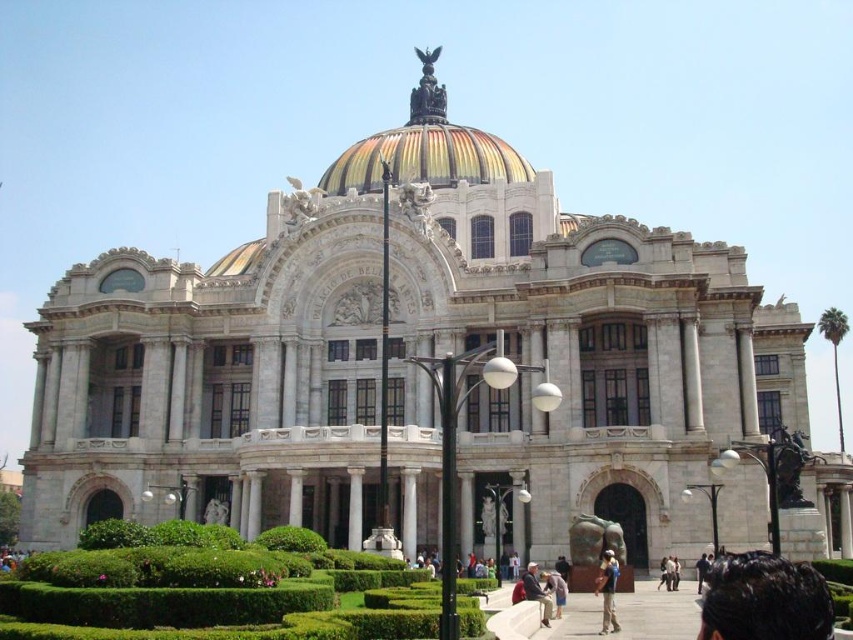
Question: Can you confirm if polished bronze eagle at center is bigger than dark blue jeans at center?

Choices:
 (A) yes
 (B) no

Answer: (A)

Question: Is dark brown hair at lower right below dark blue jeans at center?

Choices:
 (A) no
 (B) yes

Answer: (A)

Question: Among these points, which one is farthest from the camera?

Choices:
 (A) (614, 566)
 (B) (296, 205)
 (C) (409, 116)
 (D) (317, 532)

Answer: (C)

Question: Which point is farther to the camera?

Choices:
 (A) dark blue jeans at center
 (B) light brown leather jacket at center
 (C) dark brown hair at lower right
 (D) polished bronze eagle at center

Answer: (D)

Question: Is white marble statue at upper center below light brown leather jacket at center?

Choices:
 (A) no
 (B) yes

Answer: (A)

Question: Which is nearer to the white marble statue at upper center?

Choices:
 (A) light brown leather jacket at center
 (B) dark blue jeans at center
 (C) green leafy hedge at lower center
 (D) dark brown hair at lower right

Answer: (C)